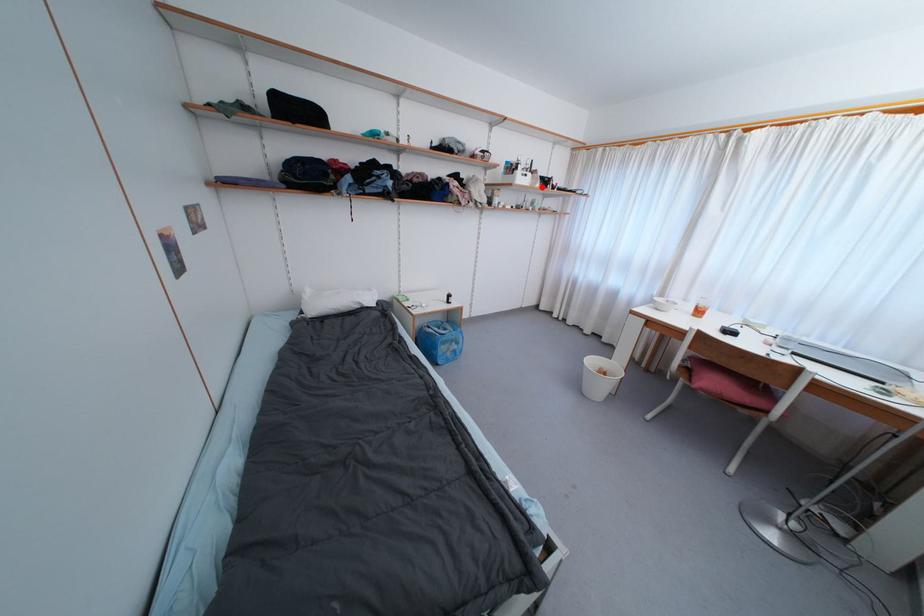
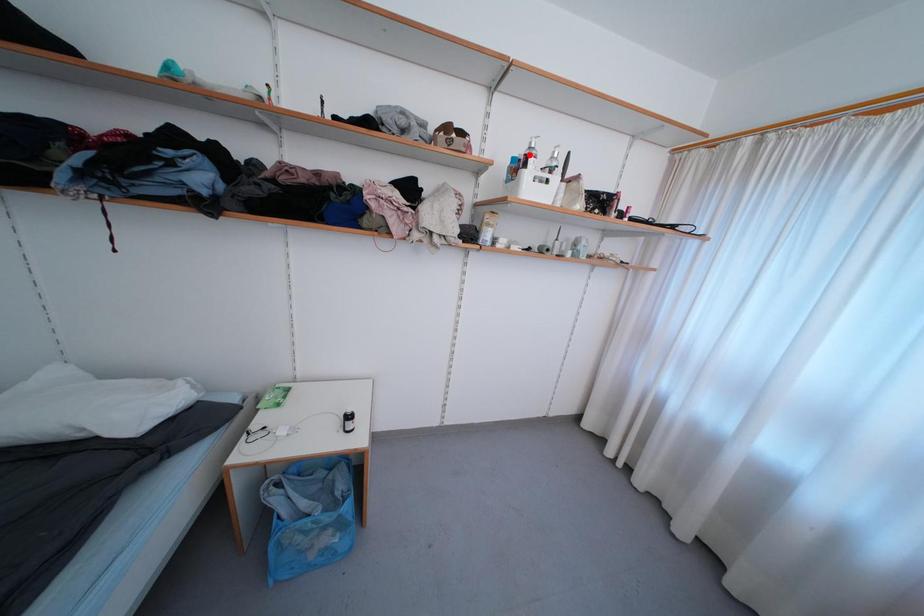
I am providing you with two images of the same scene from different viewpoints. A red point is marked on the first image and another point is marked on the second image. Are the points marked in image1 and image2 representing the same 3D position?

No